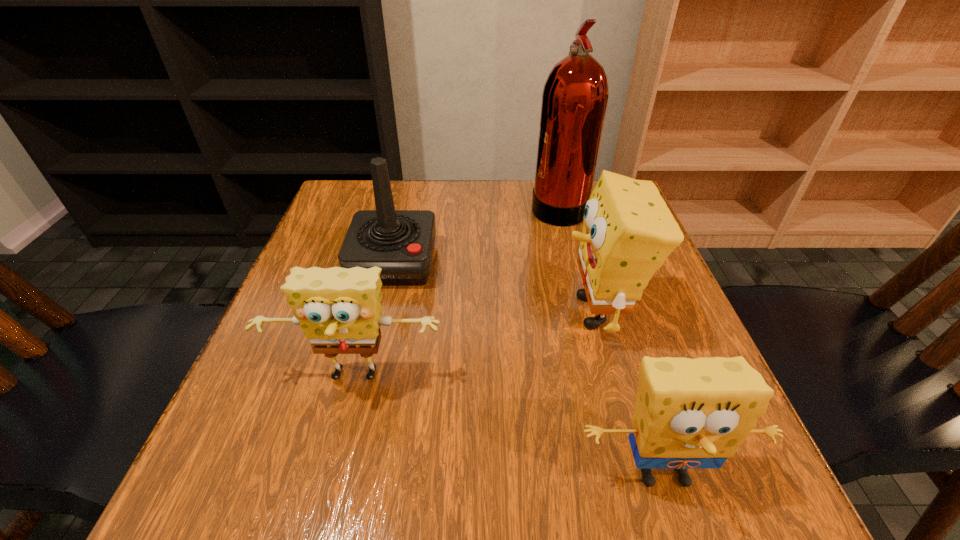
At what (x,y) coordinates should I click in order to perform the action: click on the tallest object. Please return your answer as a coordinate pair (x, y). Looking at the image, I should click on (575, 95).

Locate an element on the screen. This screenshot has width=960, height=540. the farthest object is located at coordinates (575, 95).

Locate an element on the screen. the tallest sponge is located at coordinates (628, 231).

Identify the location of joystick. (401, 242).

Image resolution: width=960 pixels, height=540 pixels. In order to click on the leftmost sponge in this screenshot , I will do `click(339, 309)`.

This screenshot has width=960, height=540. What are the coordinates of `the second nearest sponge` in the screenshot? It's located at (339, 309).

The height and width of the screenshot is (540, 960). Identify the location of the nearest object. (x=689, y=413).

The width and height of the screenshot is (960, 540). Identify the location of vacant space located on the front-facing side of the fire extinguisher. (446, 205).

Identify the location of vacant space located 0.340m on the front-facing side of the fire extinguisher. This screenshot has height=540, width=960. (400, 205).

The image size is (960, 540). I want to click on free space located on the front-facing side of the fire extinguisher, so click(x=496, y=205).